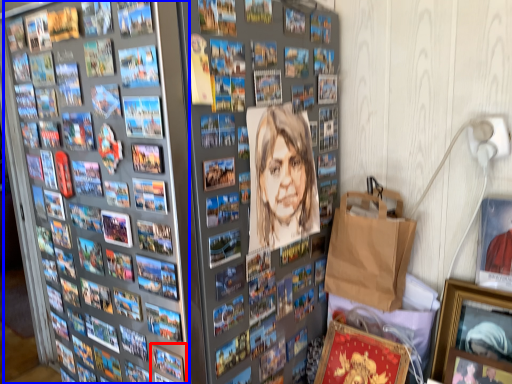
Question: Which point is closer to the camera, picture frame (highlighted by a red box) or comic book (highlighted by a blue box)?

Choices:
 (A) picture frame
 (B) comic book

Answer: (B)